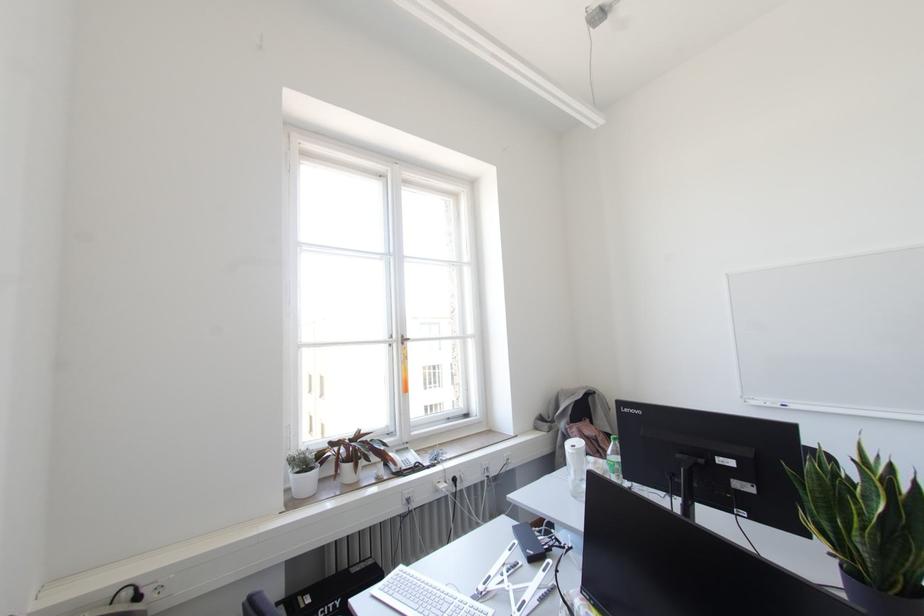
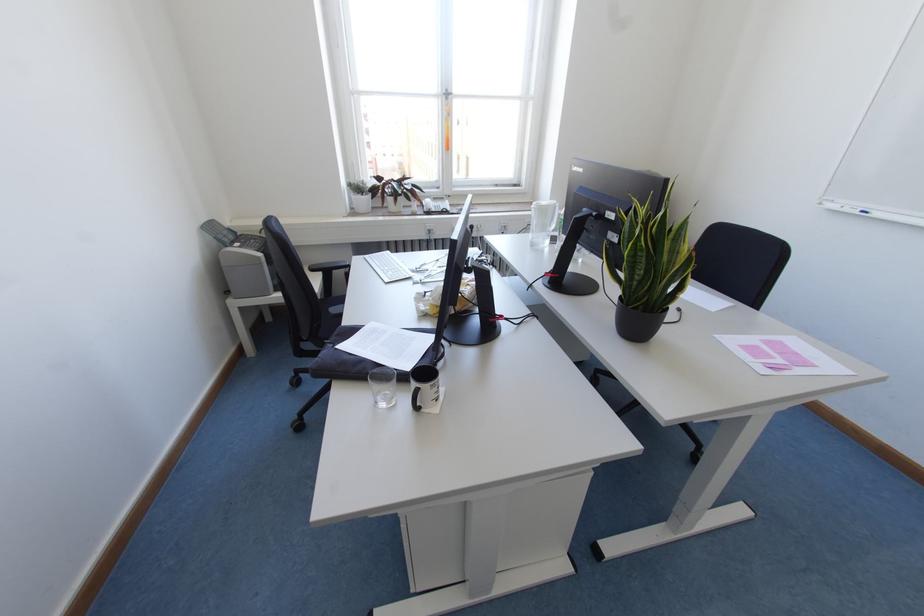
The images are taken continuously from a first-person perspective. In which direction is your viewpoint rotating?

The camera rotated toward left-down.